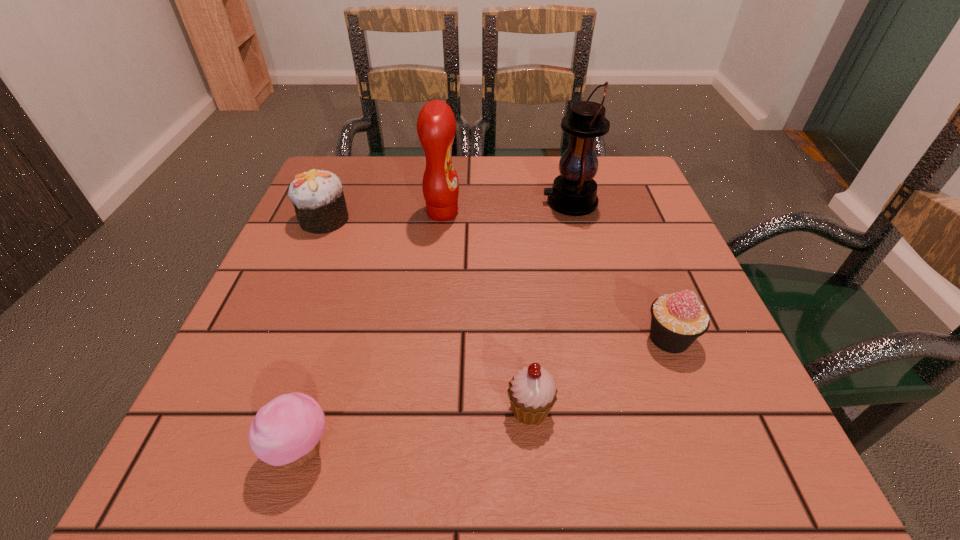
Where is `object located in the far right corner section of the desktop`? The height and width of the screenshot is (540, 960). object located in the far right corner section of the desktop is located at coordinates (574, 192).

Where is `vacant space at the far edge`? vacant space at the far edge is located at coordinates (550, 187).

Identify the location of free space at the near edge. (537, 447).

I want to click on free location at the left edge of the desktop, so click(x=280, y=294).

What are the coordinates of `vacant space at the right edge` in the screenshot? It's located at (612, 238).

Locate an element on the screen. This screenshot has height=540, width=960. vacant region at the far left corner of the desktop is located at coordinates (345, 181).

The image size is (960, 540). In the image, there is a desktop. What are the coordinates of `vacant region at the near left corner` in the screenshot? It's located at (224, 447).

Find the location of a particular element. The image size is (960, 540). free space at the far right corner is located at coordinates (606, 167).

The height and width of the screenshot is (540, 960). Identify the location of blank region between the farthest cupcake and the fourth object from left to right. (427, 314).

At what (x,y) coordinates should I click in order to perform the action: click on free space that is in between the condiment and the third object from right to left. Please return your answer as a coordinate pair (x, y). Looking at the image, I should click on (486, 311).